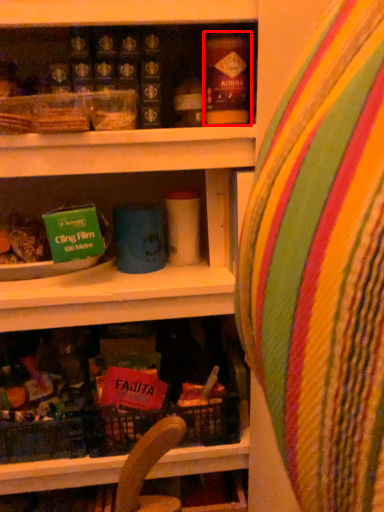
Question: From the image, what is the correct spatial relationship of yoghurt (annotated by the red box) in relation to bean bag chair?

Choices:
 (A) left
 (B) right

Answer: (A)